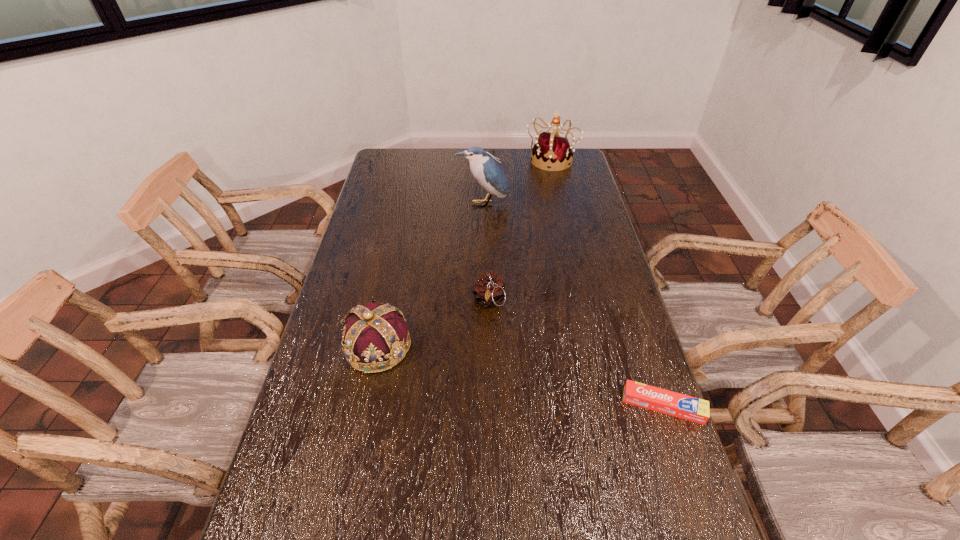
The height and width of the screenshot is (540, 960). In order to click on vacant region located with a leaf charm attached to the pinecone in this screenshot , I will do `click(489, 405)`.

At what (x,y) coordinates should I click in order to perform the action: click on free location located with a leaf charm attached to the pinecone. Please return your answer as a coordinate pair (x, y). Looking at the image, I should click on (489, 346).

In order to click on blank space located 0.050m with a leaf charm attached to the pinecone in this screenshot , I will do `click(489, 329)`.

The image size is (960, 540). Identify the location of vacant space positioned 0.290m on the front-facing side of the tiara. (534, 208).

Where is `free space located 0.310m on the front-facing side of the tiara`? This screenshot has width=960, height=540. free space located 0.310m on the front-facing side of the tiara is located at coordinates (533, 211).

You are a GUI agent. You are given a task and a screenshot of the screen. Output one action in this format:
    pyautogui.click(x=<x>, y=<y>)
    Task: Click on the free space located 0.360m on the front-facing side of the tiara
    This screenshot has height=540, width=960.
    Given the screenshot: What is the action you would take?
    pyautogui.click(x=531, y=218)

Locate an element on the screen. The height and width of the screenshot is (540, 960). vacant region located at the tip of the fourth nearest object's beak is located at coordinates (488, 239).

At what (x,y) coordinates should I click in order to perform the action: click on free spot located at the tip of the fourth nearest object's beak. Please return your answer as a coordinate pair (x, y). Looking at the image, I should click on (489, 246).

This screenshot has width=960, height=540. I want to click on vacant space situated 0.240m at the tip of the fourth nearest object's beak, so click(x=489, y=249).

Find the location of a particular element. The width and height of the screenshot is (960, 540). object that is at the far edge is located at coordinates (552, 150).